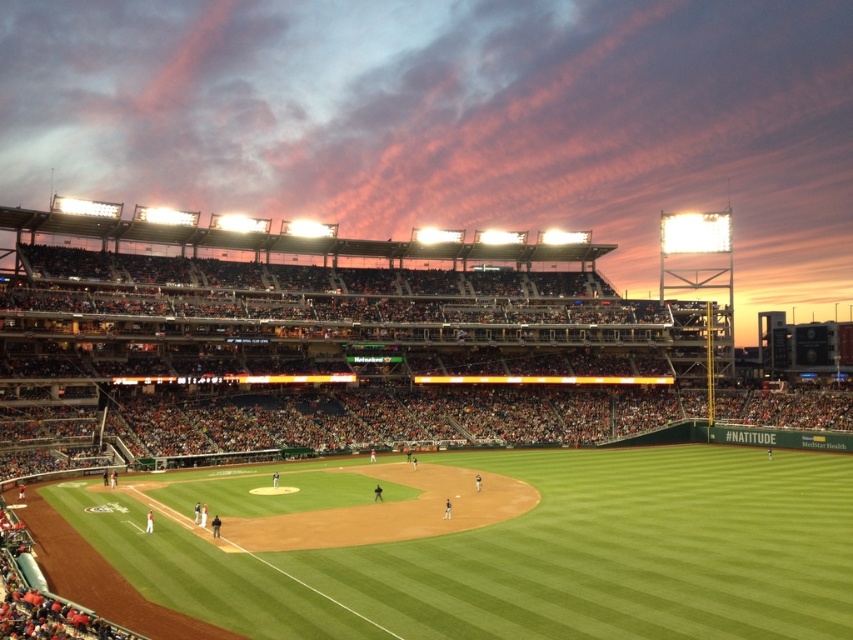
You are a groundskeeper at the baseball stadium and need to water the green grass baseball stadium at center and the green grass baseball field at center. If your watering hose can only reach 15 meters, can you water both areas without moving the hose? Please explain your reasoning.

The distance between the green grass baseball stadium at center and the green grass baseball field at center is 17.03 meters, which is greater than the 15 meter reach of the hose. Therefore, you cannot water both areas without moving the hose.

You are a groundskeeper at the baseball stadium and need to mow the green grass baseball stadium at center and the green grass baseball field at center. Which area requires more time to mow?

The green grass baseball stadium at center is bigger than the green grass baseball field at center, so it will require more time to mow.

You are a photographer positioned at the back of the stadium stands. You want to take a photo that includes both the green grass baseball stadium at center and the green grass baseball field at center. Which object should you focus on first to ensure both are in frame?

You should focus on the green grass baseball stadium at center first because it is closer to you than the green grass baseball field at center, ensuring both are in frame.